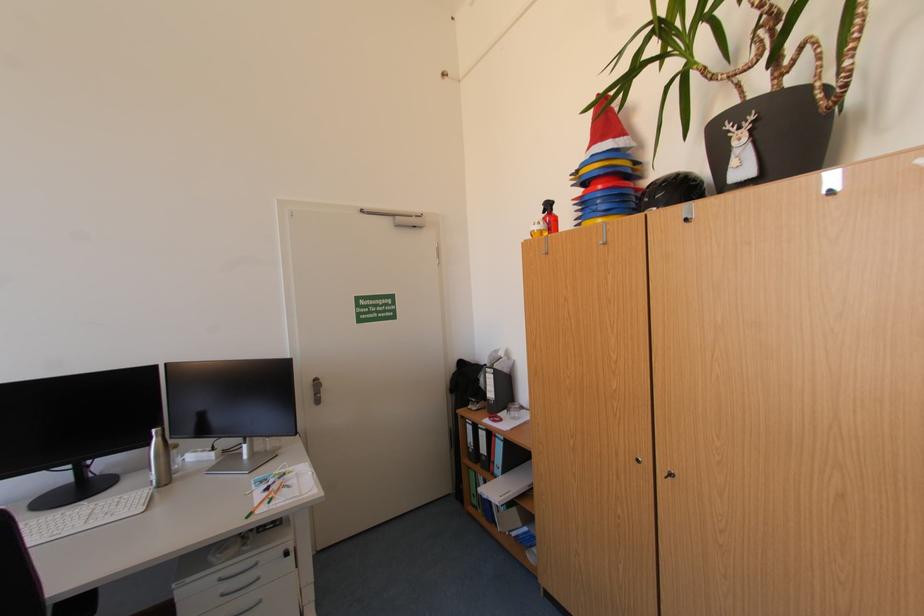
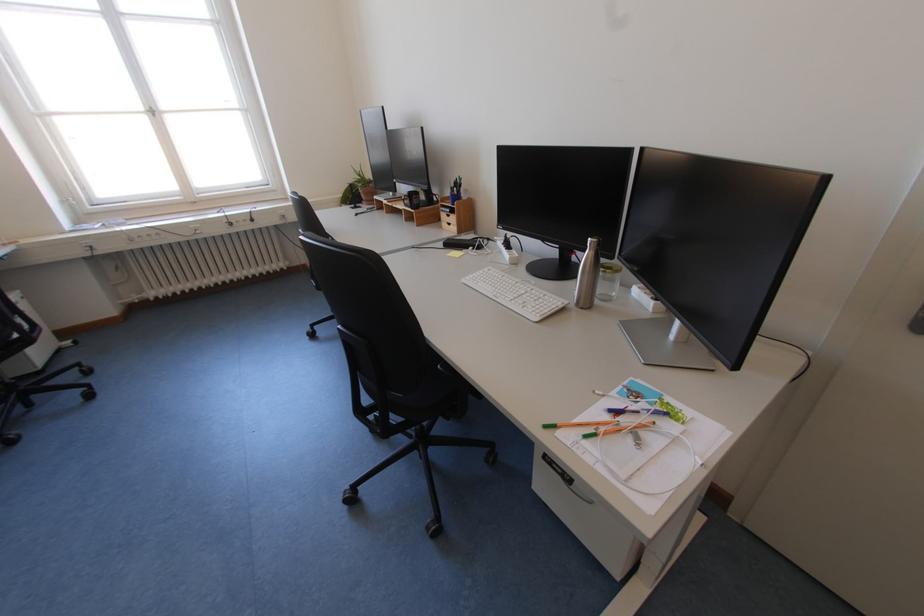
In the second image, find the point that corresponds to point 256,517 in the first image.

(553, 428)